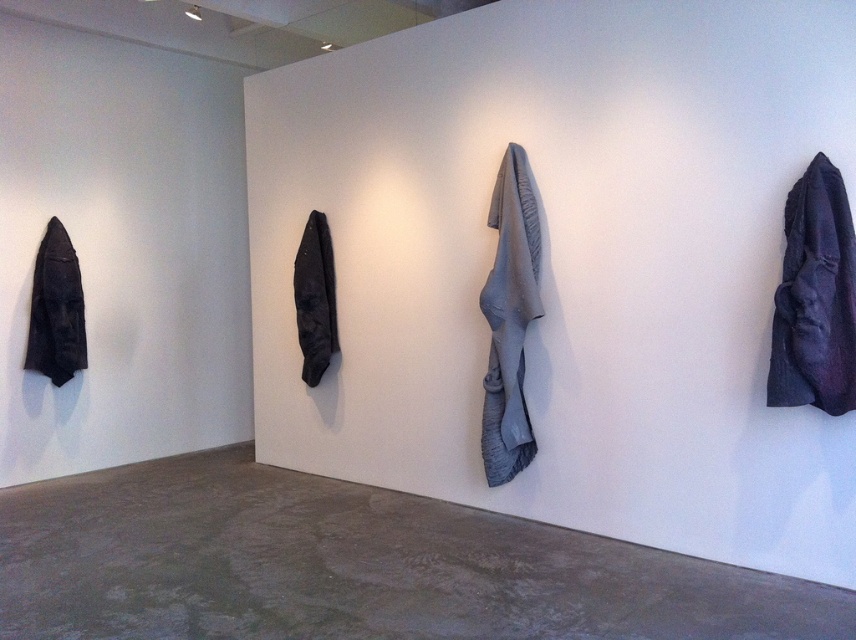
You are an art curator planning to install a new sculpture between the gray fabric at center and the matte black jacket at center. Based on their positions, where should the sculpture be placed?

The sculpture should be placed below the matte black jacket at center since the gray fabric at center is already located below it.

You are an art curator planning to display two matte black jackets in an exhibition. The matte black jacket at left and the matte black jacket at center are both available. If you want to place the larger jacket closer to the entrance for visibility, which jacket should you choose?

The matte black jacket at left is larger in size than the matte black jacket at center, so you should choose the matte black jacket at left to place closer to the entrance for visibility.

You are an art curator standing in the gallery and want to place a new sculpture between the gray fabric at center and the matte black jacket at center. The sculpture requires 4 feet of space between them. Can you fit it there?

The gray fabric at center is 5.04 feet away from matte black jacket at center, so yes, the sculpture can be placed between them since the distance between them is sufficient to accommodate the required 4 feet of space.